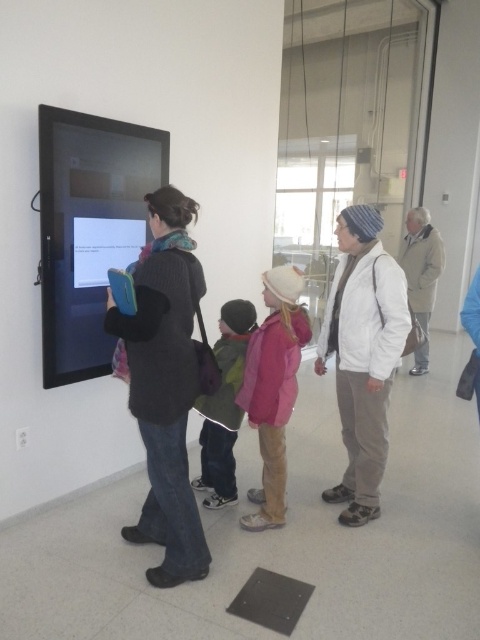
Consider the image. You are standing in the room and see the white matte jacket at center and the pink fleece jacket at center. Which jacket is positioned higher on the person wearing it?

The white matte jacket at center is located above the pink fleece jacket at center, so it is positioned higher on the person wearing it.

What is located at the coordinates point (165, 385)?

The dark gray sweater at center is located at point (165, 385).